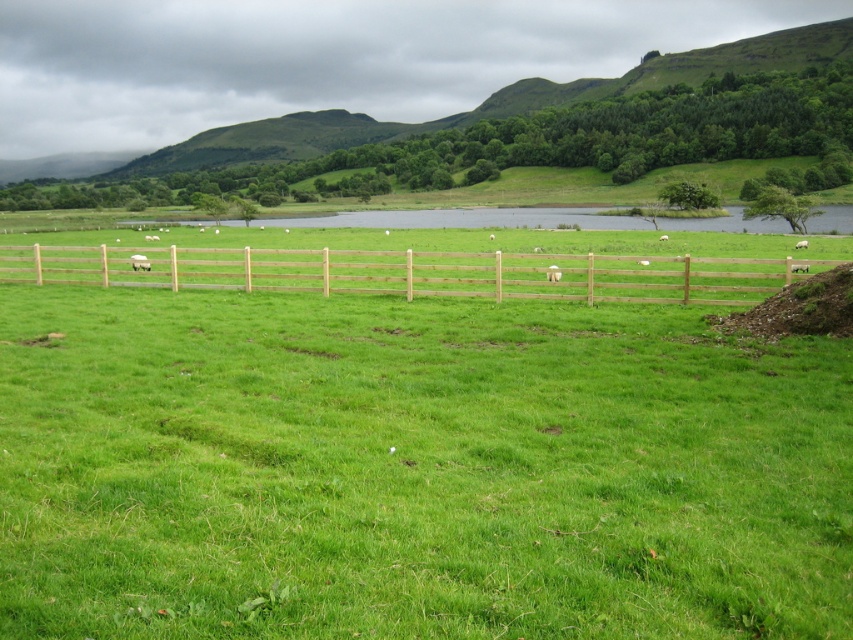
Who is positioned more to the left, white woolly sheep at center or white fluffy wool at center?

Positioned to the left is white woolly sheep at center.

Between white woolly sheep at center and white fluffy wool at center, which one has more height?

white fluffy wool at center

Does point (132, 260) come closer to viewer compared to point (550, 276)?

No, (132, 260) is further to viewer.

At what (x,y) coordinates should I click in order to perform the action: click on white woolly sheep at center. Please return your answer as a coordinate pair (x, y). The image size is (853, 640). Looking at the image, I should click on (138, 260).

Measure the distance from brown wooden fence at center to white woolly sheep at center.

brown wooden fence at center and white woolly sheep at center are 10.05 meters apart from each other.

Is point (369, 280) positioned after point (131, 260)?

No, (369, 280) is closer to viewer.

Locate an element on the screen. The height and width of the screenshot is (640, 853). brown wooden fence at center is located at coordinates (416, 273).

Which is in front, point (556, 289) or point (549, 276)?

Positioned in front is point (556, 289).

Does brown wooden fence at center have a greater width compared to white fluffy wool at center?

Yes, brown wooden fence at center is wider than white fluffy wool at center.

Is point (320, 276) farther from camera compared to point (558, 275)?

No, (320, 276) is in front of (558, 275).

Locate an element on the screen. The image size is (853, 640). brown wooden fence at center is located at coordinates (416, 273).